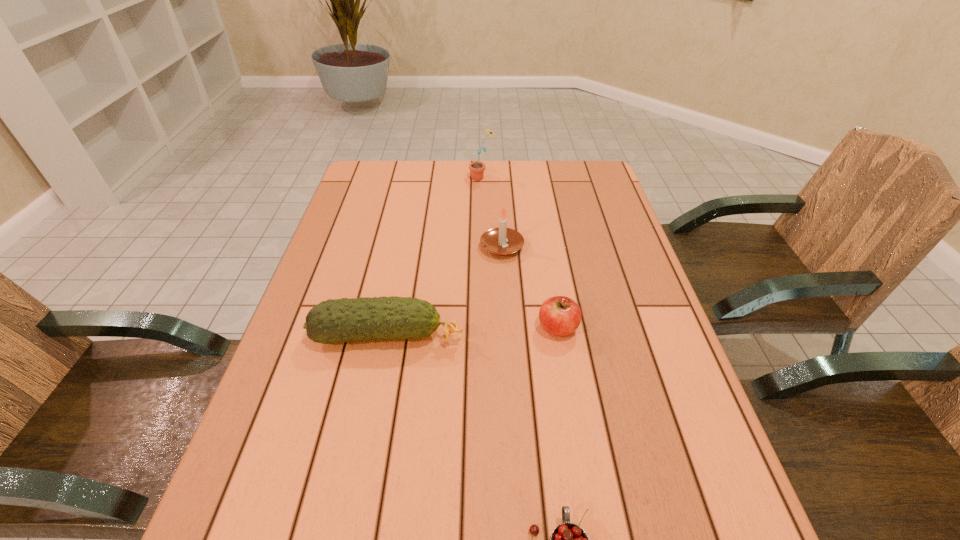
Identify the location of free space located 0.060m at the blossom end of the cucumber. This screenshot has height=540, width=960. (491, 336).

You are a GUI agent. You are given a task and a screenshot of the screen. Output one action in this format:
    pyautogui.click(x=<x>, y=<y>)
    Task: Click on the free space located on the right of the apple
    
    Given the screenshot: What is the action you would take?
    pyautogui.click(x=622, y=328)

Image resolution: width=960 pixels, height=540 pixels. I want to click on object located in the far edge section of the desktop, so click(477, 168).

Where is `object that is at the left edge`? This screenshot has height=540, width=960. object that is at the left edge is located at coordinates (332, 321).

You are a GUI agent. You are given a task and a screenshot of the screen. Output one action in this format:
    pyautogui.click(x=<x>, y=<y>)
    Task: Click on the free space at the far edge of the desktop
    
    Given the screenshot: What is the action you would take?
    coord(540,172)

You are a GUI agent. You are given a task and a screenshot of the screen. Output one action in this format:
    pyautogui.click(x=<x>, y=<y>)
    Task: Click on the free space at the left edge
    The image size is (960, 540).
    Given the screenshot: What is the action you would take?
    pyautogui.click(x=331, y=349)

Locate an element on the screen. The width and height of the screenshot is (960, 540). free space at the right edge of the desktop is located at coordinates (631, 277).

Locate an element on the screen. This screenshot has width=960, height=540. free space at the far left corner of the desktop is located at coordinates (364, 187).

Where is `vacant area at the far right corner`? vacant area at the far right corner is located at coordinates (578, 190).

Find the location of a particular element. This screenshot has height=540, width=960. vacant space in between the cucumber and the apple is located at coordinates (473, 332).